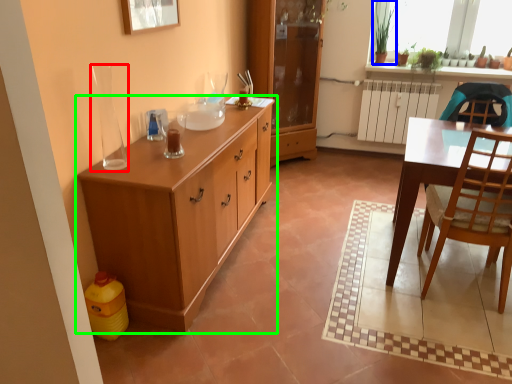
Question: Which object is positioned farthest from vase (highlighted by a red box)? Select from houseplant (highlighted by a blue box) and cabinetry (highlighted by a green box).

Choices:
 (A) houseplant
 (B) cabinetry

Answer: (A)